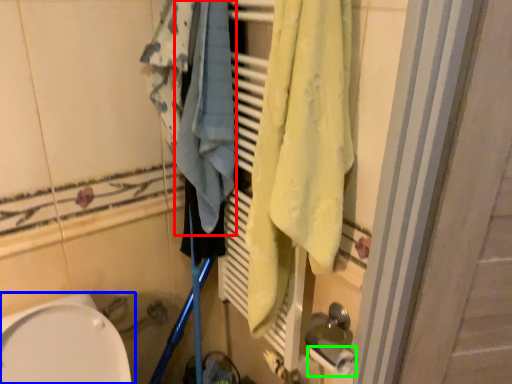
Question: Which object is the farthest from bath towel (highlighted by a red box)? Choose among these: toilet (highlighted by a blue box) or toilet paper (highlighted by a green box).

Choices:
 (A) toilet
 (B) toilet paper

Answer: (B)